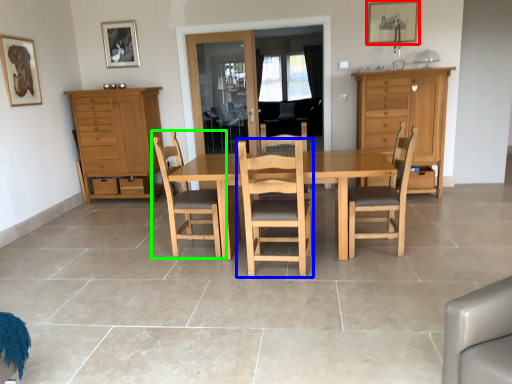
Question: Which is farther away from picture frame (highlighted by a red box)? chair (highlighted by a blue box) or chair (highlighted by a green box)?

Choices:
 (A) chair
 (B) chair

Answer: (B)